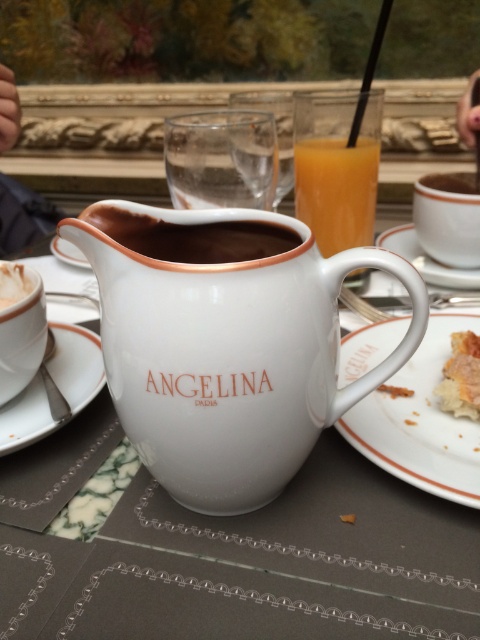
Is matte white latte at left to the left of white ceramic saucer at center from the viewer's perspective?

Indeed, matte white latte at left is positioned on the left side of white ceramic saucer at center.

Who is more forward, (7, 266) or (427, 275)?

Positioned in front is point (7, 266).

Locate an element on the screen. matte white latte at left is located at coordinates (20, 326).

Which is above, orange liquid at upper center or brown matte coffee cup at center?

brown matte coffee cup at center

What do you see at coordinates (336, 189) in the screenshot? The width and height of the screenshot is (480, 640). I see `orange liquid at upper center` at bounding box center [336, 189].

Where is `orange liquid at upper center`? The height and width of the screenshot is (640, 480). orange liquid at upper center is located at coordinates (336, 189).

Between white ceramic plate at lower right and brown matte pitcher at center, which one appears on the right side from the viewer's perspective?

From the viewer's perspective, white ceramic plate at lower right appears more on the right side.

Is white ceramic plate at lower right shorter than brown matte pitcher at center?

No.

This screenshot has width=480, height=640. What do you see at coordinates (420, 420) in the screenshot?
I see `white ceramic plate at lower right` at bounding box center [420, 420].

The width and height of the screenshot is (480, 640). I want to click on white ceramic plate at lower right, so click(x=420, y=420).